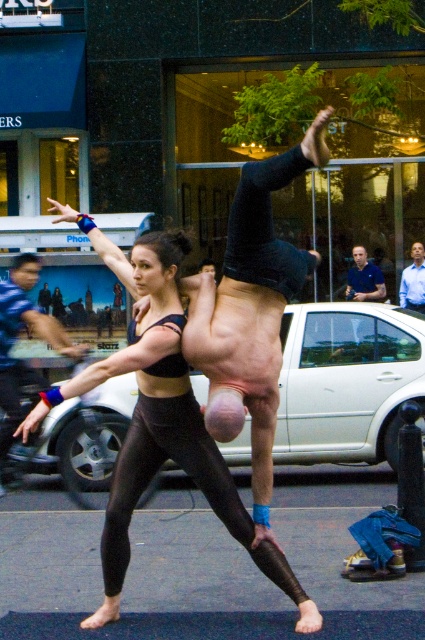
Based on the scene description, can you determine the spatial relationship between the black matte leggings at center and the blue shirt at center?

The black matte leggings at center are positioned to the left of the blue shirt at center.

You are a photographer capturing the street performance. You notice the black matte leggings at center and the blue shirt at center. Which one is closer to the camera based on their positions?

The black matte leggings at center is positioned under the blue shirt at center, so the blue shirt at center is closer to the camera.

You are a photographer trying to capture the street performance. You notice the matte black tank top at center and the blue shirt at upper right. Which of these two items is positioned higher in the image?

The matte black tank top at center has a greater height compared to the blue shirt at upper right, so the matte black tank top at center is positioned higher in the image.